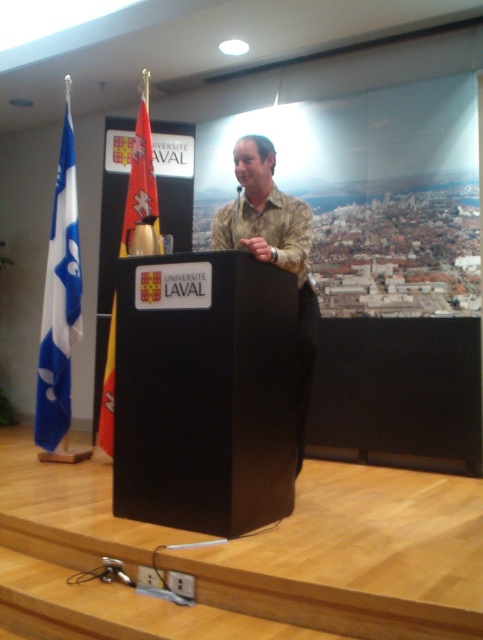
You are a photographer positioned at the center of the room. You need to capture a photo of the camouflage shirt at center. What is the exact coordinate where you should aim your camera?

The camouflage shirt at center is located at coordinate point (x=273, y=250). Aim your camera there to capture it.